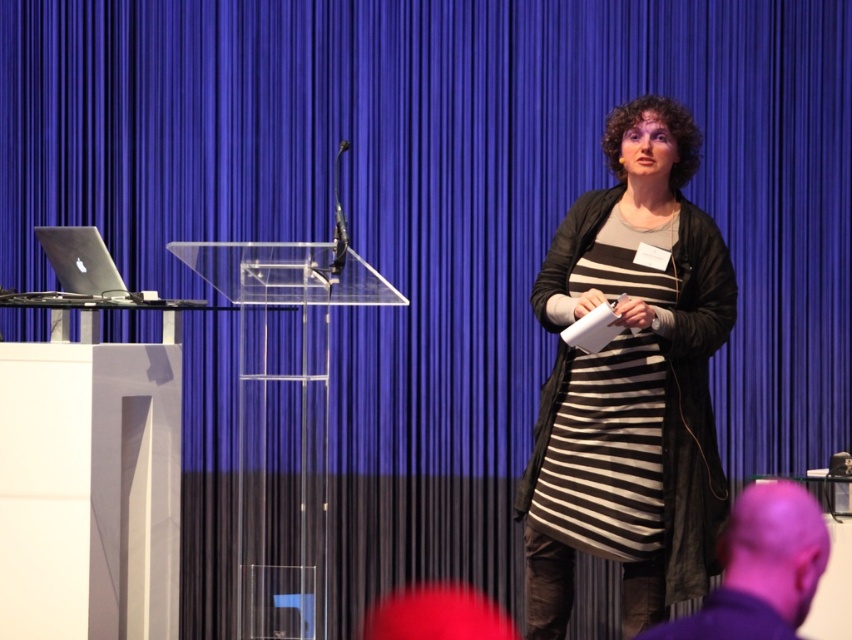
Which is below, striped fabric dress at center or purple hair at lower right?

purple hair at lower right

Who is more distant from viewer, (543, 282) or (760, 500)?

Answer: Point (543, 282)

Is point (545, 284) positioned behind point (743, 541)?

That is True.

At what (x,y) coordinates should I click in order to perform the action: click on striped fabric dress at center. Please return your answer as a coordinate pair (x, y). The height and width of the screenshot is (640, 852). Looking at the image, I should click on (630, 385).

Does purple hair at lower right have a lesser width compared to silver metallic laptop at left?

Incorrect, purple hair at lower right's width is not less than silver metallic laptop at left's.

Does purple hair at lower right lie behind silver metallic laptop at left?

No, it is in front of silver metallic laptop at left.

Image resolution: width=852 pixels, height=640 pixels. Identify the location of purple hair at lower right. (760, 568).

Is striped fabric dress at center to the left of silver metallic laptop at left from the viewer's perspective?

In fact, striped fabric dress at center is to the right of silver metallic laptop at left.

Between striped fabric dress at center and silver metallic laptop at left, which one has less height?

Standing shorter between the two is silver metallic laptop at left.

Where is `striped fabric dress at center`? This screenshot has width=852, height=640. striped fabric dress at center is located at coordinates (630, 385).

You are a GUI agent. You are given a task and a screenshot of the screen. Output one action in this format:
    pyautogui.click(x=<x>, y=<y>)
    Task: Click on the striped fabric dress at center
    
    Given the screenshot: What is the action you would take?
    pyautogui.click(x=630, y=385)